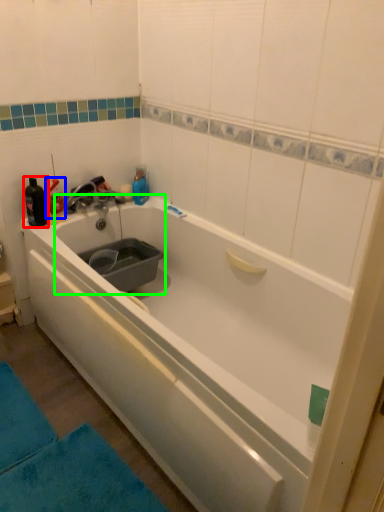
Question: Considering the real-world distances, which object is closest to bottle (highlighted by a red box)? bottle (highlighted by a blue box) or sink (highlighted by a green box).

Choices:
 (A) bottle
 (B) sink

Answer: (A)